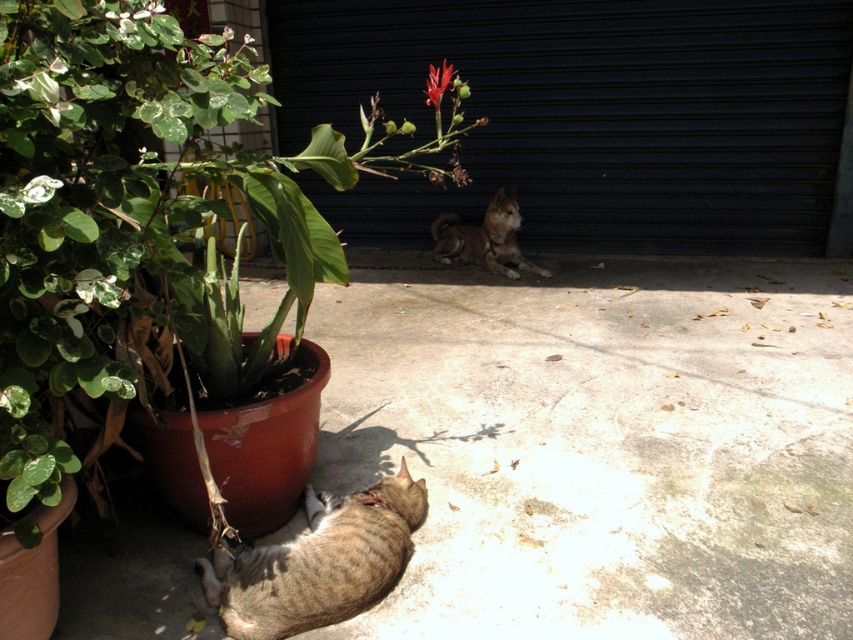
Does matte terracotta pot at lower left have a larger size compared to tabby fur cat at lower left?

Yes.

What do you see at coordinates (137, 211) in the screenshot? I see `matte terracotta pot at lower left` at bounding box center [137, 211].

Locate an element on the screen. The height and width of the screenshot is (640, 853). matte terracotta pot at lower left is located at coordinates (137, 211).

Between matte terracotta pot at lower left and brown fur dog at center, which one has more height?

Standing taller between the two is matte terracotta pot at lower left.

Can you confirm if matte terracotta pot at lower left is wider than brown fur dog at center?

Yes, matte terracotta pot at lower left is wider than brown fur dog at center.

The height and width of the screenshot is (640, 853). I want to click on matte terracotta pot at lower left, so click(x=137, y=211).

At what (x,y) coordinates should I click in order to perform the action: click on matte terracotta pot at lower left. Please return your answer as a coordinate pair (x, y). Looking at the image, I should click on (137, 211).

Image resolution: width=853 pixels, height=640 pixels. What do you see at coordinates (585, 115) in the screenshot? I see `black metal/gate at center` at bounding box center [585, 115].

Measure the distance between black metal/gate at center and camera.

They are 15.64 feet apart.

Identify the location of black metal/gate at center. Image resolution: width=853 pixels, height=640 pixels. (585, 115).